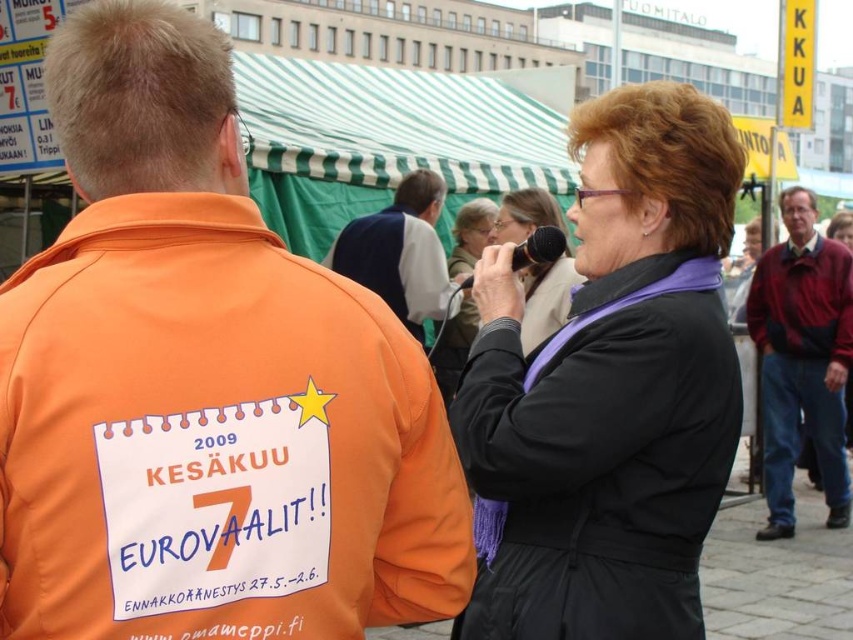
Consider the image. You are a photographer at the event and want to take a photo of the dark blue vest at center and the black plastic microphone at upper center. Which object is on the left side when looking at the scene?

The dark blue vest at center is positioned on the left side of the black plastic microphone at upper center, so the dark blue vest at center is on the left.

You are at a political rally and notice two attendees wearing distinct clothing items. The maroon sweater at upper right and the dark blue vest at center. Which clothing item is positioned lower in the image?

The maroon sweater at upper right is located below the dark blue vest at center, so it is positioned lower in the image.